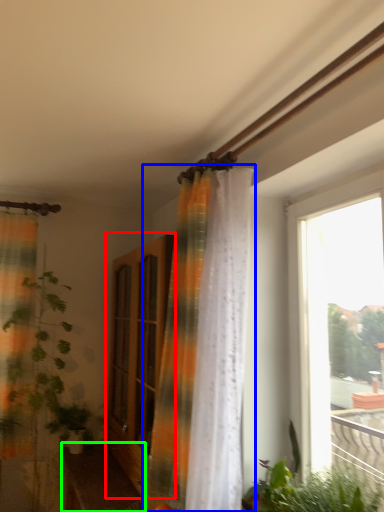
Question: Considering the real-world distances, which object is farthest from screen door (highlighted by a red box)? curtain (highlighted by a blue box) or furniture (highlighted by a green box)?

Choices:
 (A) curtain
 (B) furniture

Answer: (B)